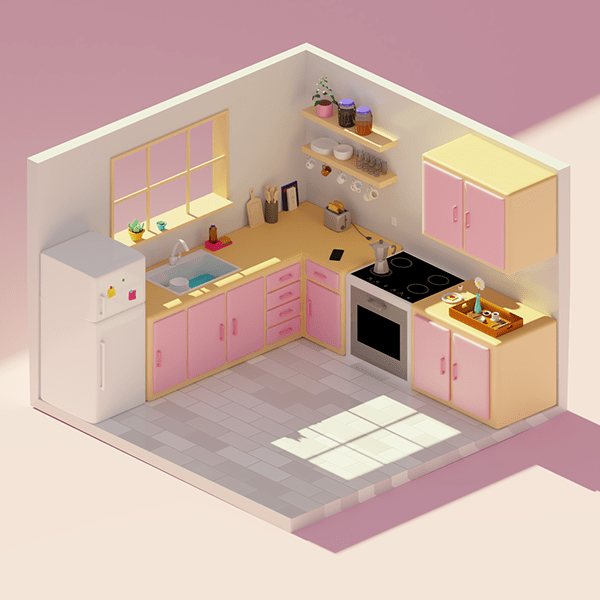
Find the location of a particular element. pink cabinet doors is located at coordinates (465, 386), (420, 365), (485, 220), (442, 212), (175, 362), (197, 335), (255, 321).